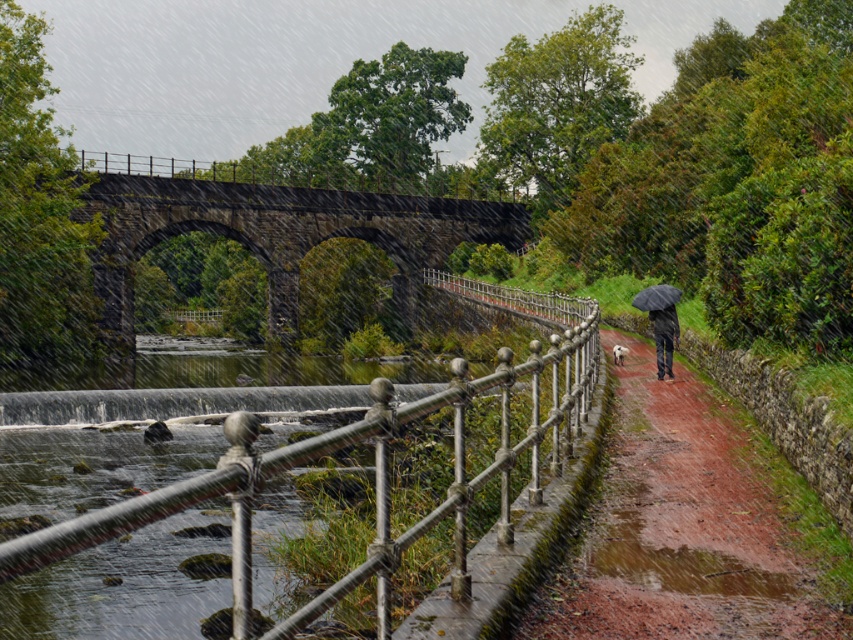
You are a tourist carrying a heavy backpack and want to walk along the damp brick path at center. However, you notice the silver metallic railing at center nearby. Which one takes up more area in the scene?

The silver metallic railing at center occupies more space than the damp brick path at center.

You are standing at the point closer to the riverbank and want to walk towards the river. Which point, point (184, 502) or point (363, 196), is closer to the river?

Point (184, 502) is closer to the river because it is in front of point (363, 196), meaning it is nearer to the riverbank.